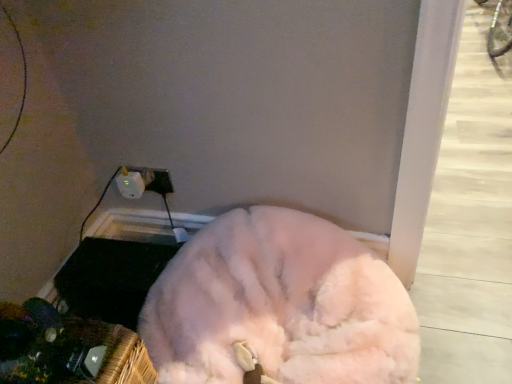
Locate an element on the screen. The height and width of the screenshot is (384, 512). white plastic electric outlet at lower left is located at coordinates (142, 181).

What do you see at coordinates (142, 181) in the screenshot?
I see `white plastic electric outlet at lower left` at bounding box center [142, 181].

You are a GUI agent. You are given a task and a screenshot of the screen. Output one action in this format:
    pyautogui.click(x=<x>, y=<y>)
    Task: Click on the fluffy white dog at lower center
    
    Given the screenshot: What is the action you would take?
    pyautogui.click(x=279, y=305)

Consider the image. Measure the distance between fluffy white dog at lower center and camera.

They are 35.28 inches apart.

What do you see at coordinates (279, 305) in the screenshot? The image size is (512, 384). I see `fluffy white dog at lower center` at bounding box center [279, 305].

You are a GUI agent. You are given a task and a screenshot of the screen. Output one action in this format:
    pyautogui.click(x=<x>, y=<y>)
    Task: Click on the white plastic electric outlet at lower left
    The height and width of the screenshot is (384, 512).
    Given the screenshot: What is the action you would take?
    pyautogui.click(x=142, y=181)

Is fluffy white dog at lower center to the left or to the right of white plastic electric outlet at lower left in the image?

In the image, fluffy white dog at lower center appears on the right side of white plastic electric outlet at lower left.

Looking at this image, considering the relative positions of fluffy white dog at lower center and white plastic electric outlet at lower left in the image provided, is fluffy white dog at lower center in front of white plastic electric outlet at lower left?

Yes, it is.

Which point is more distant from viewer, (303, 342) or (169, 186)?

Point (169, 186)

From the image's perspective, is fluffy white dog at lower center above or below white plastic electric outlet at lower left?

fluffy white dog at lower center is below white plastic electric outlet at lower left.

From a real-world perspective, is fluffy white dog at lower center under white plastic electric outlet at lower left?

Yes, from a real-world perspective, fluffy white dog at lower center is under white plastic electric outlet at lower left.

Is fluffy white dog at lower center wider than white plastic electric outlet at lower left?

Yes.

Does fluffy white dog at lower center have a greater height compared to white plastic electric outlet at lower left?

Correct, fluffy white dog at lower center is much taller as white plastic electric outlet at lower left.

Between fluffy white dog at lower center and white plastic electric outlet at lower left, which one has larger size?

With larger size is fluffy white dog at lower center.

Can white plastic electric outlet at lower left be found inside fluffy white dog at lower center?

No, white plastic electric outlet at lower left is not a part of fluffy white dog at lower center.

Based on the photo, are fluffy white dog at lower center and white plastic electric outlet at lower left located far from each other?

No, fluffy white dog at lower center is in close proximity to white plastic electric outlet at lower left.

Is fluffy white dog at lower center oriented away from white plastic electric outlet at lower left?

No, white plastic electric outlet at lower left is not at the back of fluffy white dog at lower center.

The image size is (512, 384). I want to click on dog that is in front of the white plastic electric outlet at lower left, so click(x=279, y=305).

Does white plastic electric outlet at lower left appear on the left side of fluffy white dog at lower center?

Yes, white plastic electric outlet at lower left is to the left of fluffy white dog at lower center.

Does white plastic electric outlet at lower left lie behind fluffy white dog at lower center?

Yes, the depth of white plastic electric outlet at lower left is greater than that of fluffy white dog at lower center.

Is point (139, 181) farther from camera compared to point (398, 351)?

Yes, it is.

From the image's perspective, is white plastic electric outlet at lower left located above fluffy white dog at lower center?

Correct, white plastic electric outlet at lower left appears higher than fluffy white dog at lower center in the image.

From a real-world perspective, is white plastic electric outlet at lower left beneath fluffy white dog at lower center?

No, from a real-world perspective, white plastic electric outlet at lower left is not beneath fluffy white dog at lower center.

Does white plastic electric outlet at lower left have a lesser width compared to fluffy white dog at lower center?

Correct, the width of white plastic electric outlet at lower left is less than that of fluffy white dog at lower center.

Which of these two, white plastic electric outlet at lower left or fluffy white dog at lower center, stands taller?

With more height is fluffy white dog at lower center.

Considering the sizes of objects white plastic electric outlet at lower left and fluffy white dog at lower center in the image provided, who is smaller, white plastic electric outlet at lower left or fluffy white dog at lower center?

With smaller size is white plastic electric outlet at lower left.

Is white plastic electric outlet at lower left inside or outside of fluffy white dog at lower center?

white plastic electric outlet at lower left is located beyond the bounds of fluffy white dog at lower center.

Is white plastic electric outlet at lower left far from fluffy white dog at lower center?

No, white plastic electric outlet at lower left is in close proximity to fluffy white dog at lower center.

Is white plastic electric outlet at lower left oriented towards fluffy white dog at lower center?

No, white plastic electric outlet at lower left is not aimed at fluffy white dog at lower center.

You are a GUI agent. You are given a task and a screenshot of the screen. Output one action in this format:
    pyautogui.click(x=<x>, y=<y>)
    Task: Click on the dog in front of the white plastic electric outlet at lower left
    Image resolution: width=512 pixels, height=384 pixels.
    Given the screenshot: What is the action you would take?
    pyautogui.click(x=279, y=305)

Where is `dog that is below the white plastic electric outlet at lower left (from the image's perspective)`? This screenshot has height=384, width=512. dog that is below the white plastic electric outlet at lower left (from the image's perspective) is located at coordinates (279, 305).

Find the location of a particular element. Image resolution: width=512 pixels, height=384 pixels. electric outlet behind the fluffy white dog at lower center is located at coordinates (142, 181).